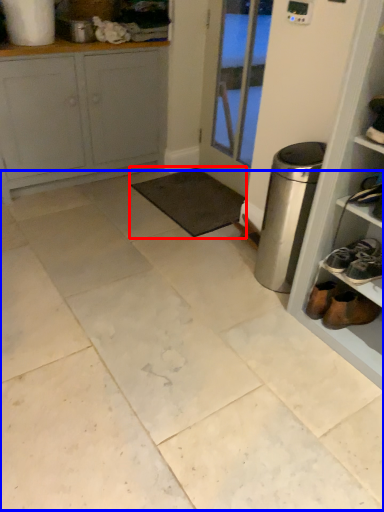
Question: Among these objects, which one is nearest to the camera, mat (highlighted by a red box) or ceramic tile (highlighted by a blue box)?

Choices:
 (A) mat
 (B) ceramic tile

Answer: (B)